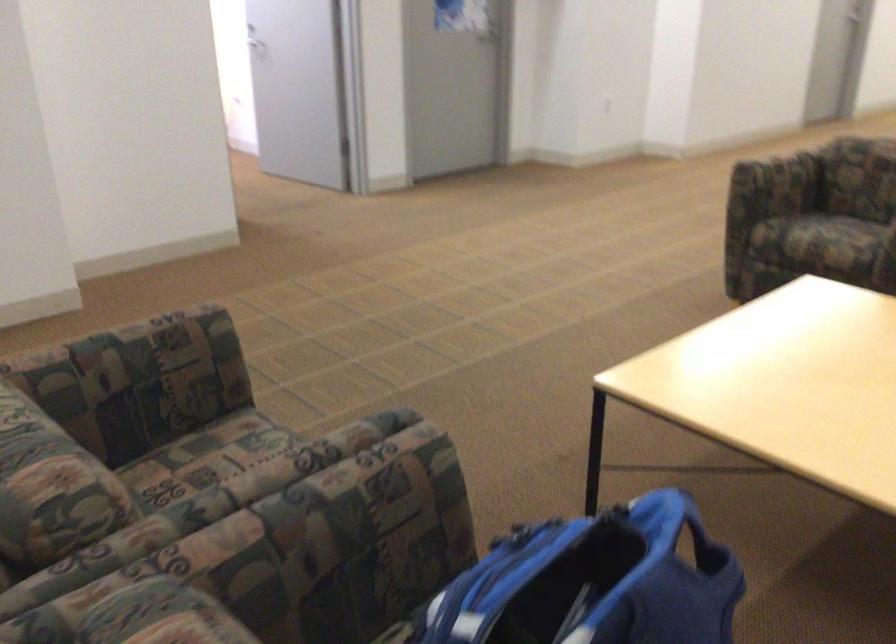
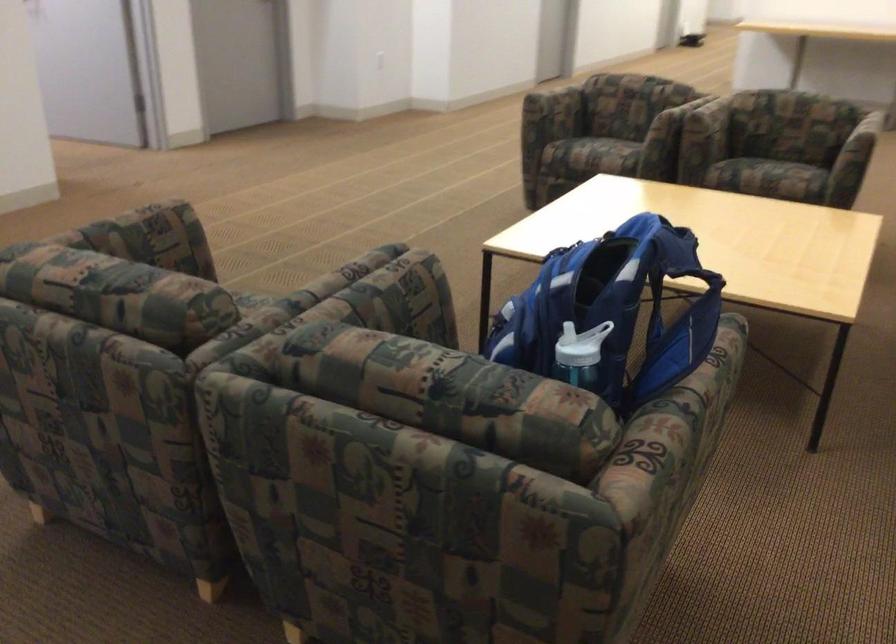
The images are taken continuously from a first-person perspective. In which direction are you moving?

The movement direction of the cameraman is left, backward.